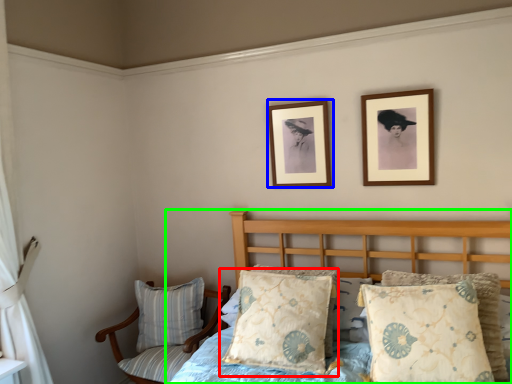
Question: Which object is the closest to the pillow (highlighted by a red box)? Choose among these: picture frame (highlighted by a blue box) or bed (highlighted by a green box).

Choices:
 (A) picture frame
 (B) bed

Answer: (B)